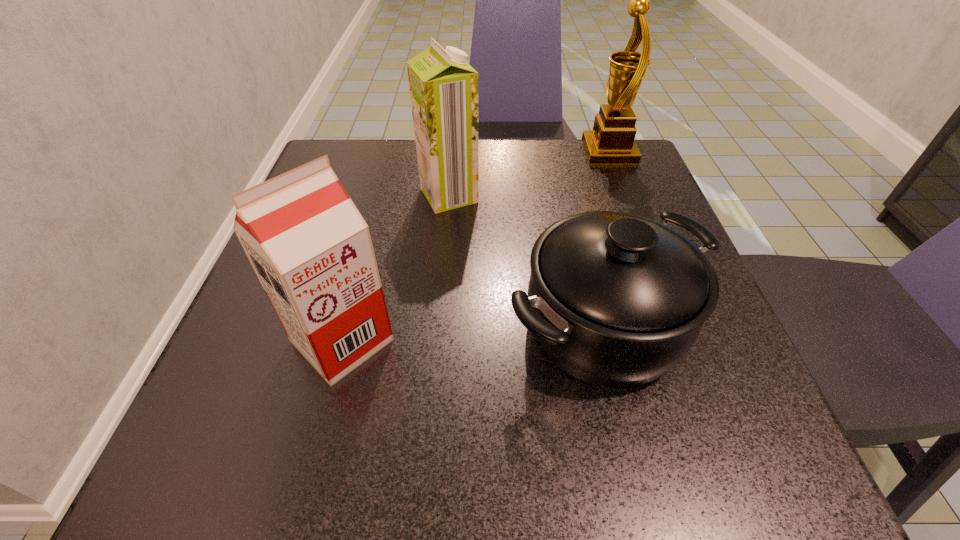
Where is `award`? The image size is (960, 540). award is located at coordinates (611, 142).

This screenshot has width=960, height=540. I want to click on the third nearest object, so click(443, 87).

Where is `the second object from left to right`? The image size is (960, 540). the second object from left to right is located at coordinates (443, 87).

Where is `the left soya milk`? This screenshot has width=960, height=540. the left soya milk is located at coordinates (311, 249).

This screenshot has height=540, width=960. What are the coordinates of `the nearer soya milk` in the screenshot? It's located at (311, 249).

What are the coordinates of `the shortest object` in the screenshot? It's located at (615, 299).

At what (x,y) coordinates should I click in order to perform the action: click on free space located on the front-facing side of the award. Please return your answer as a coordinate pair (x, y). Looking at the image, I should click on (446, 152).

Identify the location of free location located 0.380m on the front-facing side of the award. (425, 152).

Identify the location of free space located 0.290m on the front-facing side of the award. This screenshot has height=540, width=960. (463, 152).

Locate an element on the screen. This screenshot has height=540, width=960. vacant point located 0.140m on the front of the right soya milk is located at coordinates (444, 262).